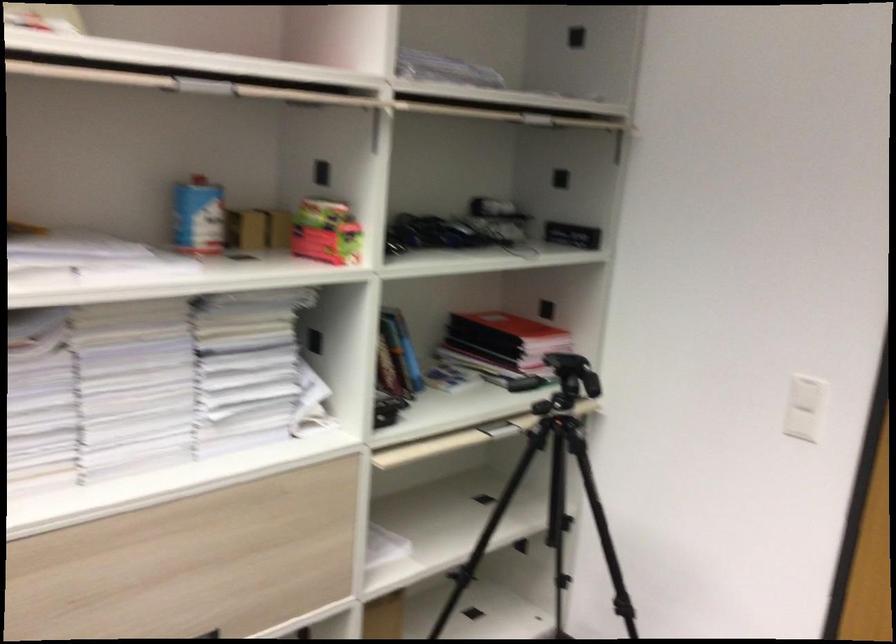
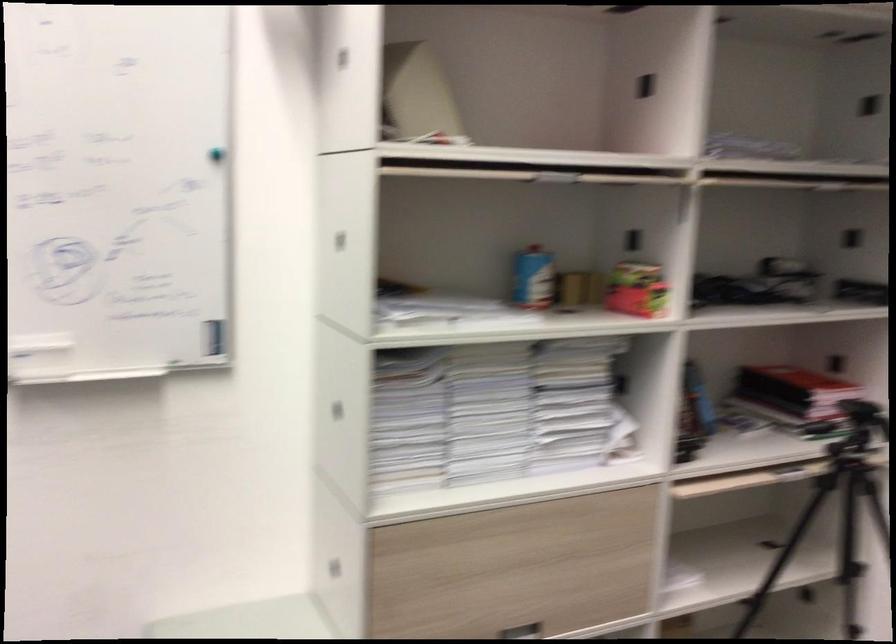
The point at (323, 234) is marked in the first image. Where is the corresponding point in the second image?

(636, 289)